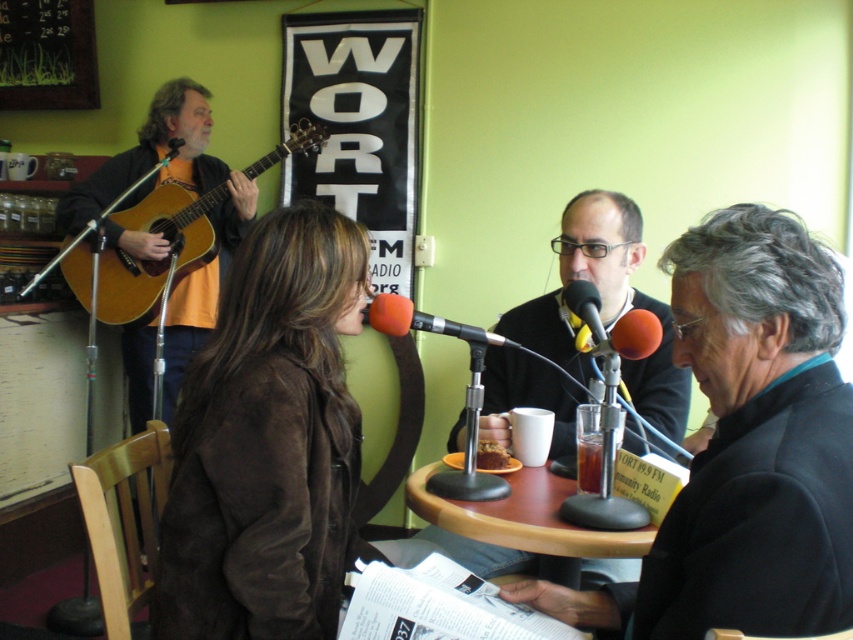
Question: Among these points, which one is farthest from the camera?

Choices:
 (A) 583,545
 (B) 508,342
 (C) 292,604

Answer: (B)

Question: Which point is closer to the camera?

Choices:
 (A) (581, 456)
 (B) (532, 547)
 (C) (148, 298)
 (D) (403, 328)

Answer: (B)

Question: Does brushed metal bulletin board at upper left have a larger size compared to orange foam microphone at center?

Choices:
 (A) no
 (B) yes

Answer: (B)

Question: Which object is farther from the camera taking this photo?

Choices:
 (A) brown suede jacket at center
 (B) orange foam microphone at center

Answer: (B)

Question: Can you confirm if wooden acoustic guitar at left is smaller than brushed metal bulletin board at upper left?

Choices:
 (A) yes
 (B) no

Answer: (B)

Question: Does brushed metal bulletin board at upper left have a larger size compared to orange foam microphone at center?

Choices:
 (A) no
 (B) yes

Answer: (B)